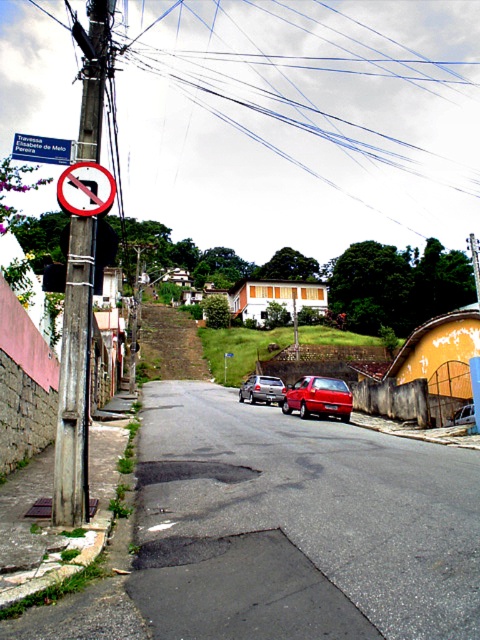
You are driving a metallic silver sedan at center and want to park it under the smooth gray pole at left. Can the sedan fit under the pole without hitting it?

The smooth gray pole at left is taller than the metallic silver sedan at center, so the sedan can fit under the pole without hitting it.

You are standing at the point closer to the camera in this street scene. There are two points marked in the image, one at coordinates point (324, 400) and another at point (34, 140). Which point are you standing at?

You are standing at point (34, 140) because it is closer to the camera compared to point (324, 400).

You are driving a truck that is 2 meters wide. You need to pass through the street where there is a smooth gray pole at left and a metallic silver sedan at center. Can your truck fit between the pole and the sedan?

The smooth gray pole at left is thinner than the metallic silver sedan at center, but the exact distance between them isn not specified. Without knowing the space between the pole and the sedan, it is impossible to determine if the truck can fit.